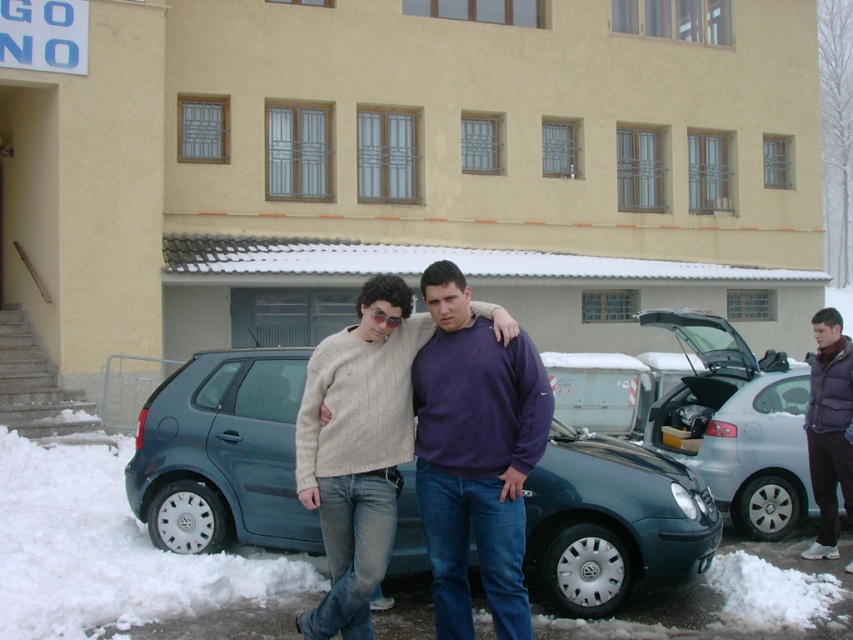
You are a delivery person needing to place a 5 meter long ladder between the satin blue hatchback at center and the purple fleece jacket at lower right. Is there enough space between them to fit the ladder horizontally?

The distance between the satin blue hatchback at center and the purple fleece jacket at lower right is 4.69 meters, which is shorter than the 5 meter ladder. Therefore, the ladder cannot be placed horizontally between them as there isn not enough space.

You are a delivery person trying to park your delivery van next to the satin blue hatchback at center and the knitted sweater at center. Which object should you avoid when parking to ensure there is enough space for your van?

You should avoid the satin blue hatchback at center because it might be wider than the knitted sweater at center, so it requires more space for parking.